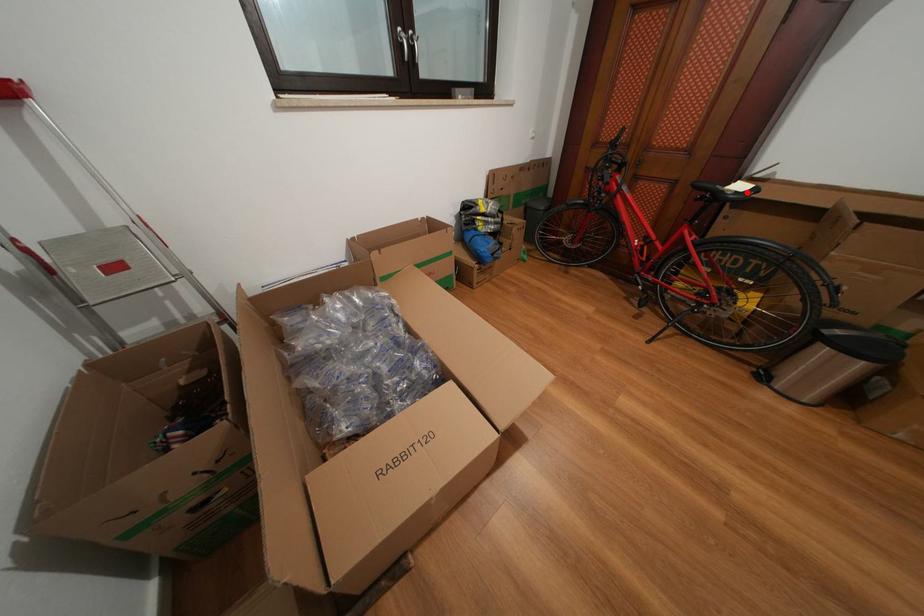
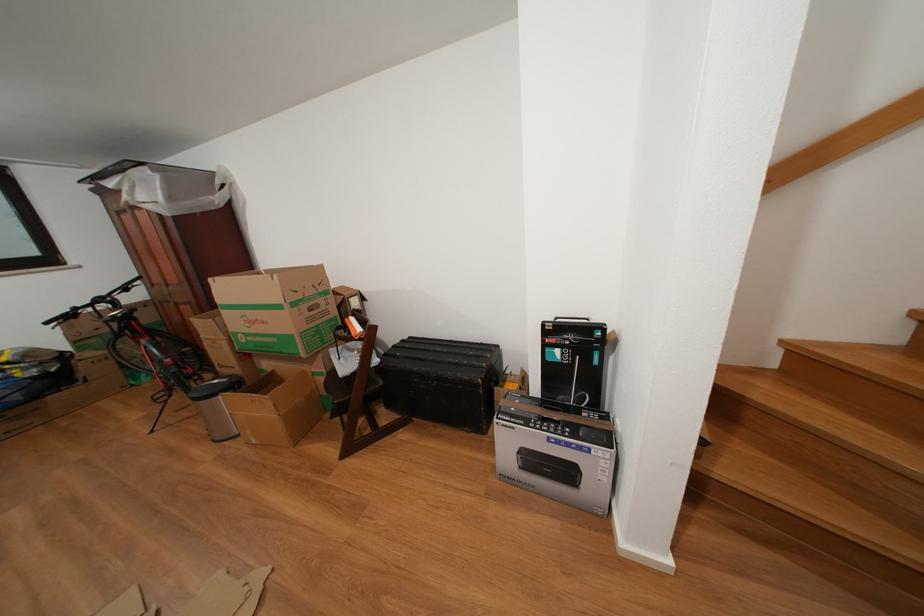
Locate, in the second image, the point that corresponds to the highlighted location in the first image.

(126, 317)